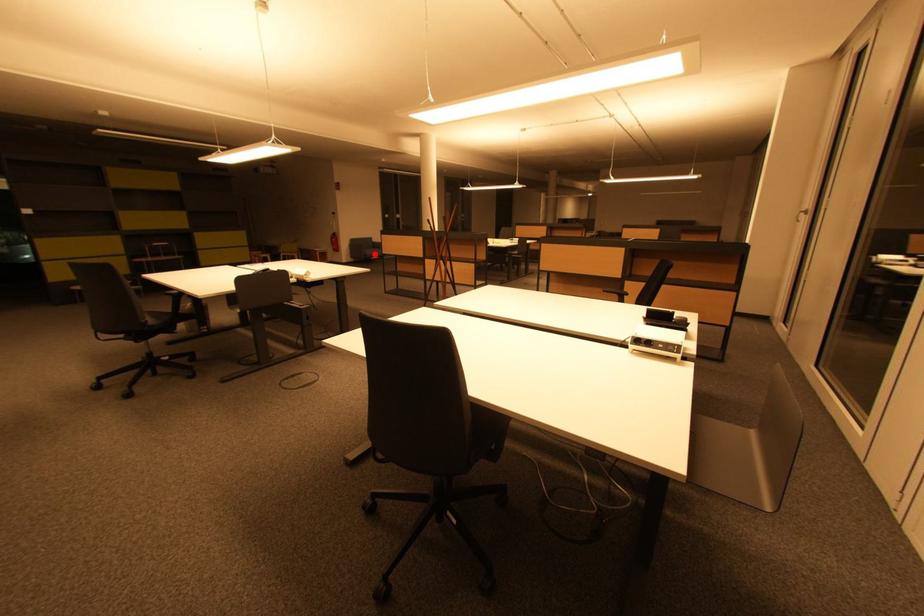
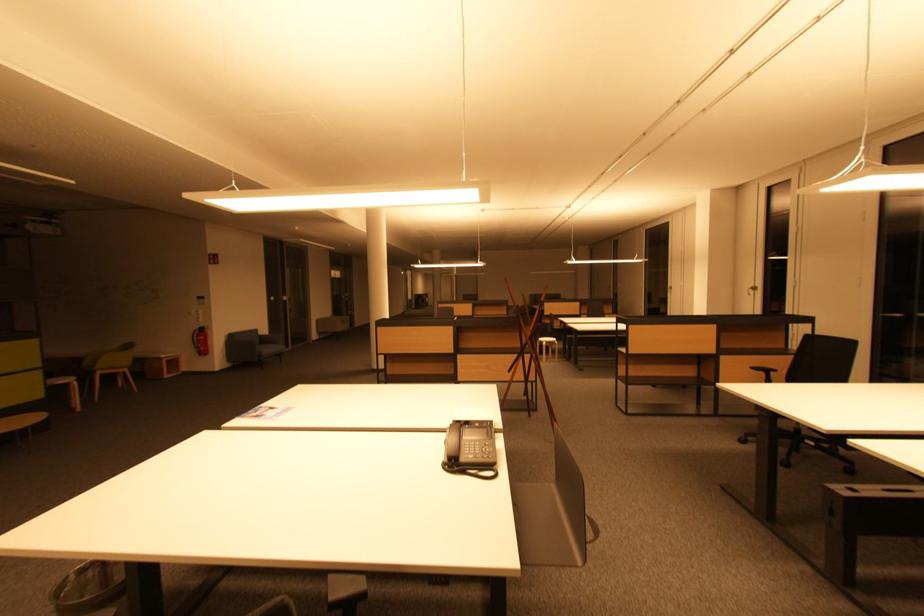
Find the pixel in the second image that matches the highlighted location in the first image.

(272, 352)